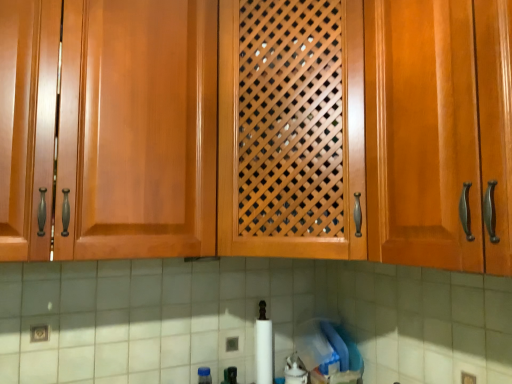
Measure the distance between point (409,278) and camera.

The distance of point (409,278) from camera is 4.32 feet.

Describe the element at coordinates (246, 318) in the screenshot. I see `white glossy granite at lower center` at that location.

The height and width of the screenshot is (384, 512). Identify the location of white glossy granite at lower center. [x=246, y=318].

Where is `white glossy granite at lower center`? The image size is (512, 384). white glossy granite at lower center is located at coordinates pos(246,318).